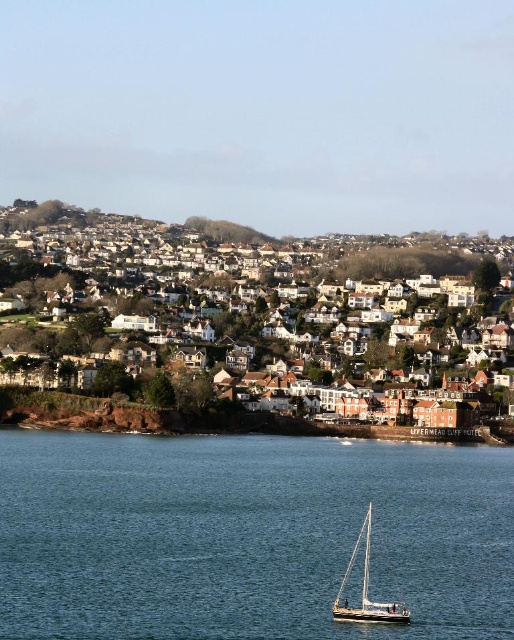
Question: Based on their relative distances, which object is farther from the white textured houses at center?

Choices:
 (A) white matte sailboat at center
 (B) blue water at lower center

Answer: (A)

Question: Which point is closer to the camera?

Choices:
 (A) (192, 577)
 (B) (344, 602)
 (C) (317, 264)

Answer: (B)

Question: Does blue water at lower center have a larger size compared to white matte sailboat at center?

Choices:
 (A) no
 (B) yes

Answer: (B)

Question: Does white textured houses at center have a larger size compared to white matte sailboat at center?

Choices:
 (A) yes
 (B) no

Answer: (A)

Question: Observing the image, what is the correct spatial positioning of blue water at lower center in reference to white textured houses at center?

Choices:
 (A) above
 (B) below

Answer: (B)

Question: Which object appears closest to the camera in this image?

Choices:
 (A) white matte sailboat at center
 (B) blue water at lower center
 (C) white textured houses at center

Answer: (B)